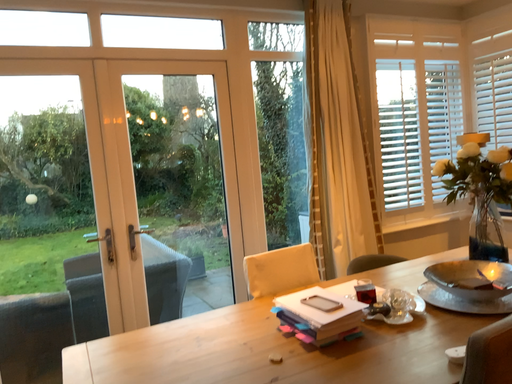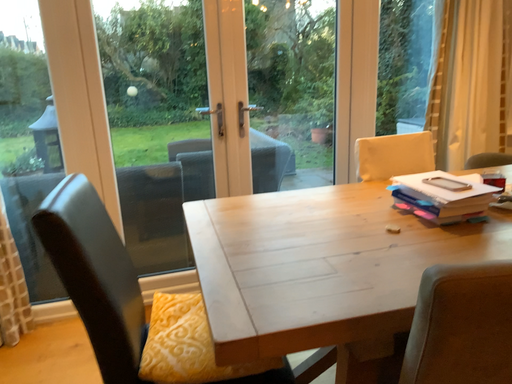
Question: How did the camera likely rotate when shooting the video?

Choices:
 (A) rotated downward
 (B) rotated upward

Answer: (A)